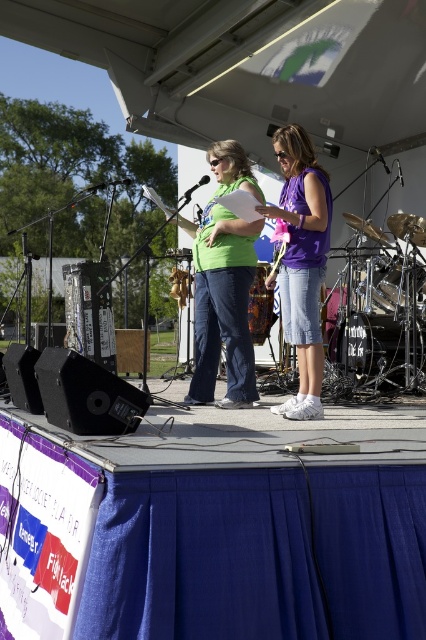
Which is more to the left, matte green shirt at center or purple cotton shirt at center?

Positioned to the left is matte green shirt at center.

Does matte green shirt at center lie behind purple cotton shirt at center?

Yes.

This screenshot has width=426, height=640. What are the coordinates of `matte green shirt at center` in the screenshot? It's located at (224, 285).

Locate an element on the screen. matte green shirt at center is located at coordinates (224, 285).